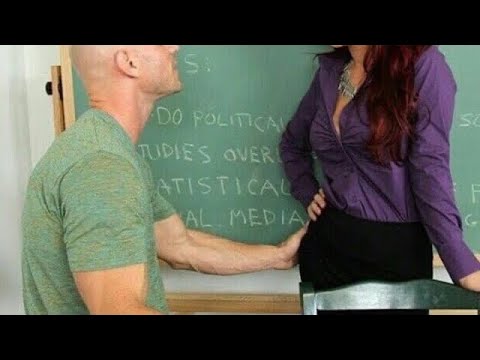
Locate an element on the screen. green chair back rest is located at coordinates (391, 296).